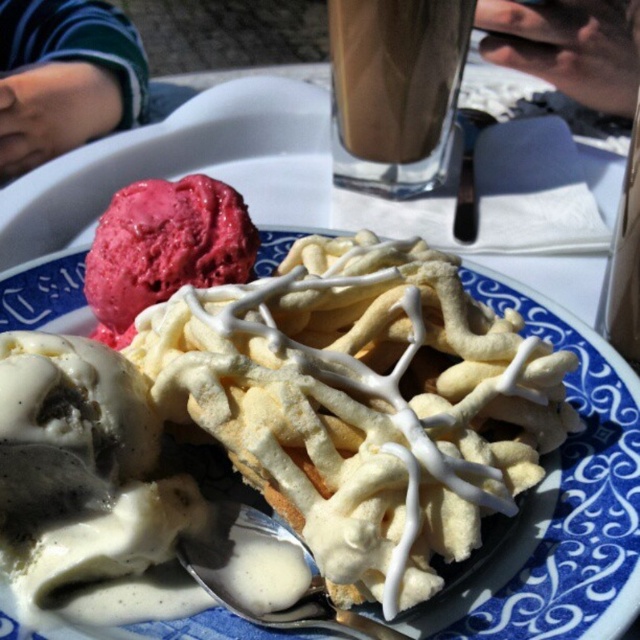
Is white glazed waffle at center bigger than translucent glass cup at upper center?

Yes, white glazed waffle at center is bigger than translucent glass cup at upper center.

The image size is (640, 640). Describe the element at coordinates (364, 403) in the screenshot. I see `white glazed waffle at center` at that location.

I want to click on white glazed waffle at center, so click(x=364, y=403).

How far apart are white glazed waffle at center and smooth raspberry ice cream at upper left?

A distance of 24.06 centimeters exists between white glazed waffle at center and smooth raspberry ice cream at upper left.

Which is more to the right, white glazed waffle at center or smooth raspberry ice cream at upper left?

white glazed waffle at center

Which is in front, point (451, 524) or point (221, 189)?

Point (451, 524) is in front.

At what (x,y) coordinates should I click in order to perform the action: click on white glazed waffle at center. Please return your answer as a coordinate pair (x, y). The image size is (640, 640). Looking at the image, I should click on (364, 403).

Is point (360, 148) farther from viewer compared to point (115, 330)?

Yes, it is behind point (115, 330).

What do you see at coordinates (394, 90) in the screenshot? Image resolution: width=640 pixels, height=640 pixels. I see `translucent glass cup at upper center` at bounding box center [394, 90].

The image size is (640, 640). Find the location of `translucent glass cup at upper center`. translucent glass cup at upper center is located at coordinates (394, 90).